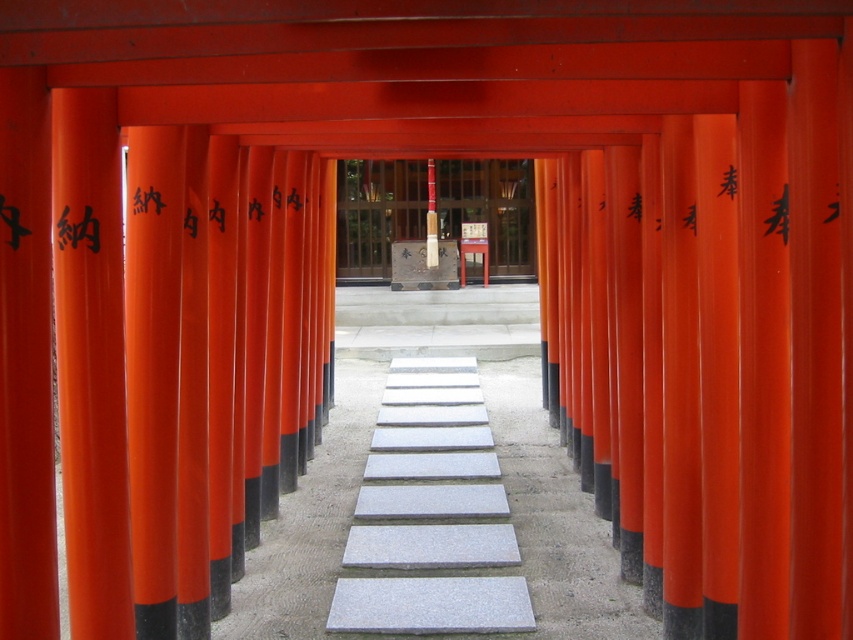
Does gray stone slabs at center have a greater width compared to smooth wooden post at center?

No.

Between gray stone slabs at center and smooth wooden post at center, which one is positioned lower?

gray stone slabs at center is lower down.

Is point (538, 497) less distant than point (521, 269)?

That is True.

Where is `gray stone slabs at center`? gray stone slabs at center is located at coordinates (558, 515).

Is gray stone slabs at center above gray stone stairs at center?

Yes.

Does gray stone slabs at center appear on the right side of gray stone stairs at center?

Correct, you'll find gray stone slabs at center to the right of gray stone stairs at center.

The width and height of the screenshot is (853, 640). Describe the element at coordinates (558, 515) in the screenshot. I see `gray stone slabs at center` at that location.

I want to click on gray stone slabs at center, so click(558, 515).

Which is below, gray stone stairs at center or smooth wooden post at center?

gray stone stairs at center

Is gray stone stairs at center above smooth wooden post at center?

No.

You are a GUI agent. You are given a task and a screenshot of the screen. Output one action in this format:
    pyautogui.click(x=<x>, y=<y>)
    Task: Click on the gray stone stairs at center
    This screenshot has height=640, width=853.
    Given the screenshot: What is the action you would take?
    pyautogui.click(x=431, y=518)

Find the location of a particular element. The image size is (853, 640). gray stone stairs at center is located at coordinates (431, 518).